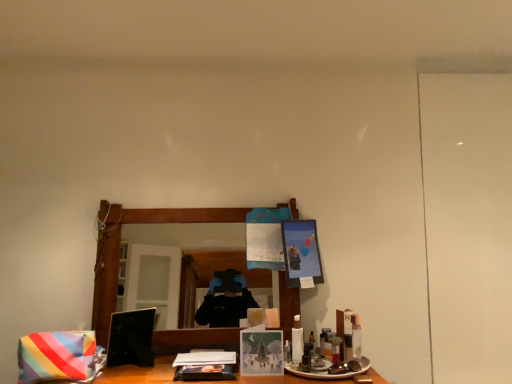
Question: From the image's perspective, is rainbow striped fabric at lower left positioned above or below matte black picture frame at upper center, which is the 1th picture frame in back-to-front order?

Choices:
 (A) above
 (B) below

Answer: (B)

Question: Considering the positions of rainbow striped fabric at lower left and matte black picture frame at upper center, which is the 1th picture frame in back-to-front order, in the image, is rainbow striped fabric at lower left wider or thinner than matte black picture frame at upper center, which is the 1th picture frame in back-to-front order,?

Choices:
 (A) thin
 (B) wide

Answer: (B)

Question: Which object is positioned closest to the matte black picture frame at upper center, positioned as the second picture frame in left-to-right order?

Choices:
 (A) white plastic bottle at center, positioned as the first toiletry in left-to-right order
 (B) clear plastic bottle at lower right, which is the second toiletry in left-to-right order
 (C) matte paper card at center, positioned as the 1th picture frame in bottom-to-top order
 (D) wooden mirror at center
 (E) rainbow striped fabric at lower left

Answer: (A)

Question: Considering the real-world distances, which object is farthest from the wooden mirror at center?

Choices:
 (A) matte paper card at center, which is counted as the first picture frame, starting from the left
 (B) white plastic bottle at center, positioned as the first toiletry in left-to-right order
 (C) rainbow striped fabric at lower left
 (D) clear plastic bottle at lower right, marked as the 1th toiletry in a right-to-left arrangement
 (E) matte black picture frame at upper center, acting as the 1th picture frame starting from the top

Answer: (D)